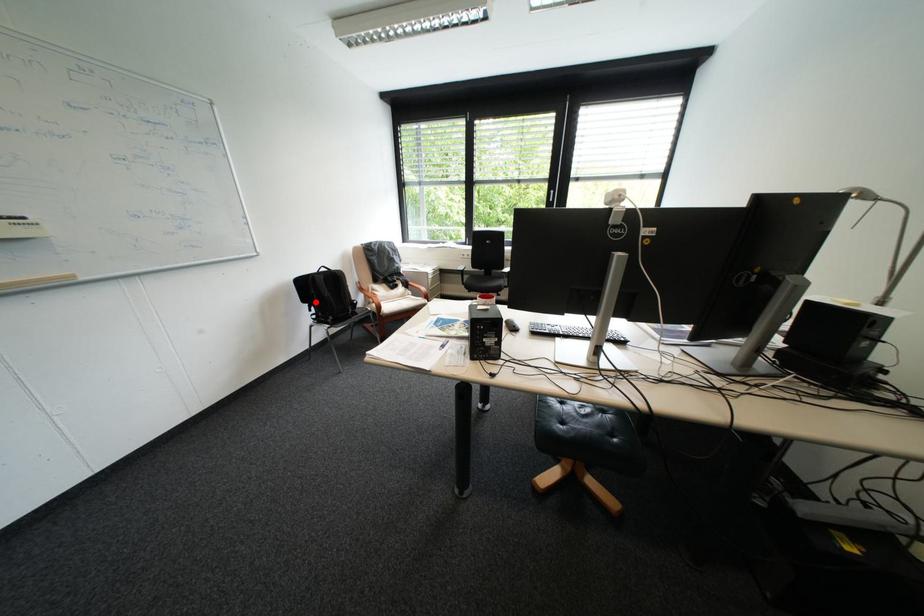
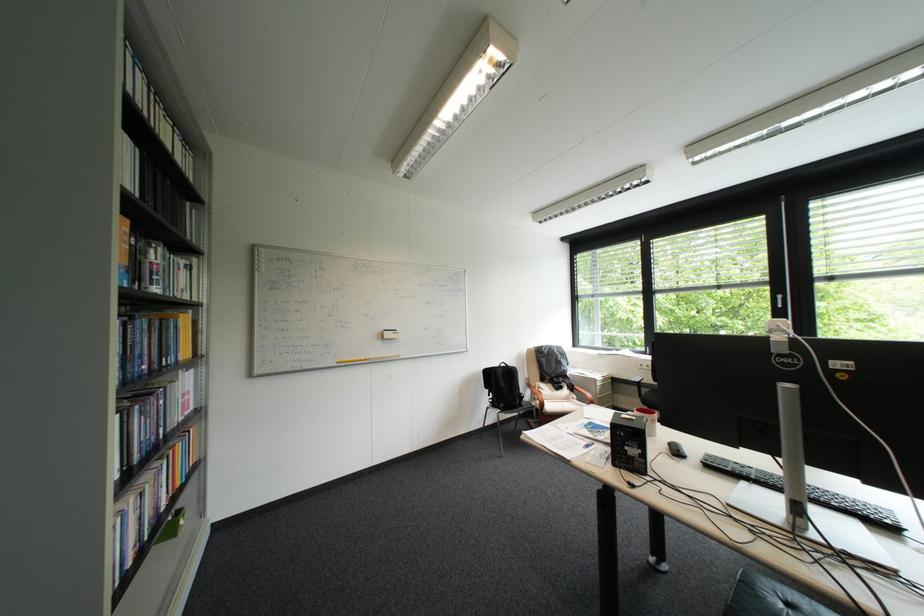
Question: I am providing you with two images of the same scene from different viewpoints. A red point is marked on the first image. Can you still see the location of the red point in image 2?

Choices:
 (A) Yes
 (B) No

Answer: (A)